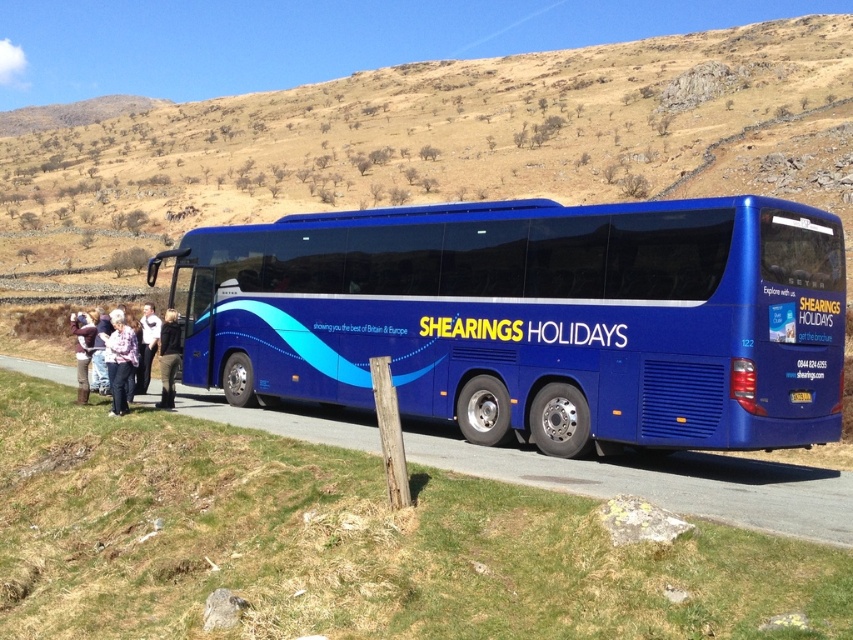
Question: Which is farther from the weathered wood post at lower center?

Choices:
 (A) floral shirt at left
 (B) brown grassy hillside at upper center

Answer: (B)

Question: Which object is the farthest from the plaid shirt at center?

Choices:
 (A) brown grassy hillside at upper center
 (B) denim jacket at lower left

Answer: (A)

Question: Is floral shirt at left positioned before denim jacket at lower left?

Choices:
 (A) no
 (B) yes

Answer: (B)

Question: Can you confirm if plaid shirt at center is positioned to the left of floral shirt at left?

Choices:
 (A) no
 (B) yes

Answer: (A)

Question: Does weathered wood post at lower center appear on the left side of light pink fabric pants at lower left?

Choices:
 (A) no
 (B) yes

Answer: (A)

Question: Among these points, which one is farthest from the camera?

Choices:
 (A) (161, 349)
 (B) (399, 490)

Answer: (A)